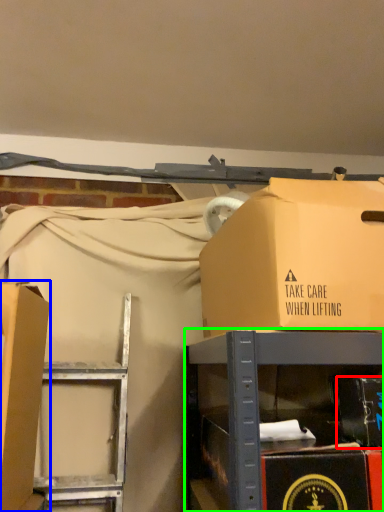
Question: Considering the real-world distances, which object is closest to box (highlighted by a red box)? box (highlighted by a blue box) or furniture (highlighted by a green box).

Choices:
 (A) box
 (B) furniture

Answer: (B)